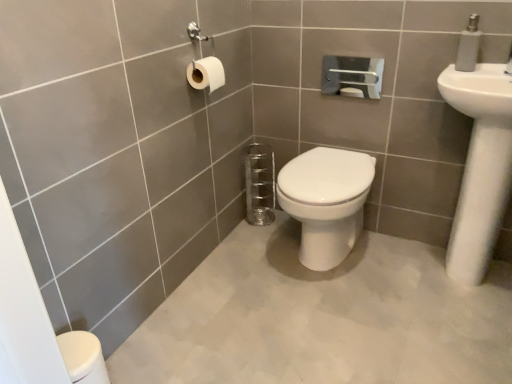
The width and height of the screenshot is (512, 384). I want to click on vacant space to the left of white glossy toilet at center, so click(x=231, y=270).